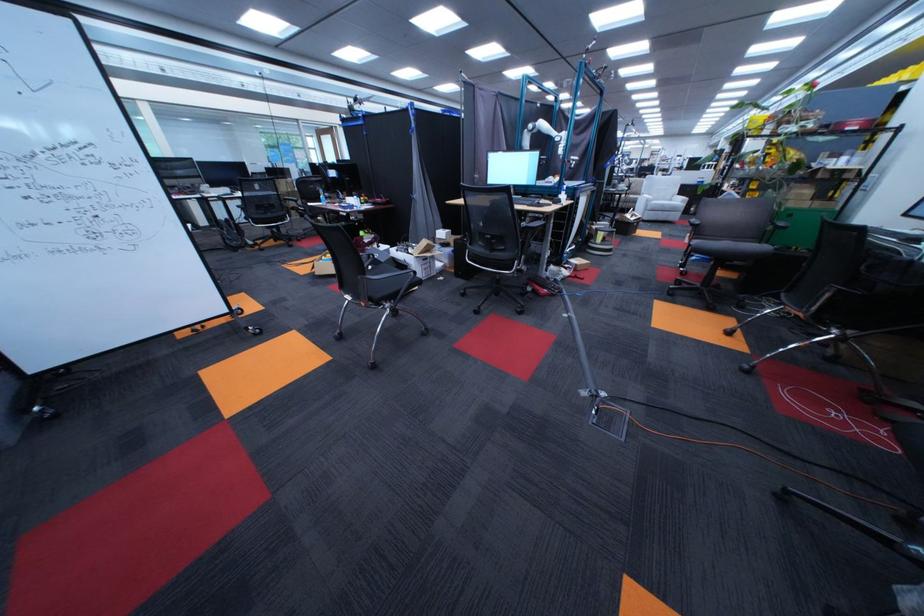
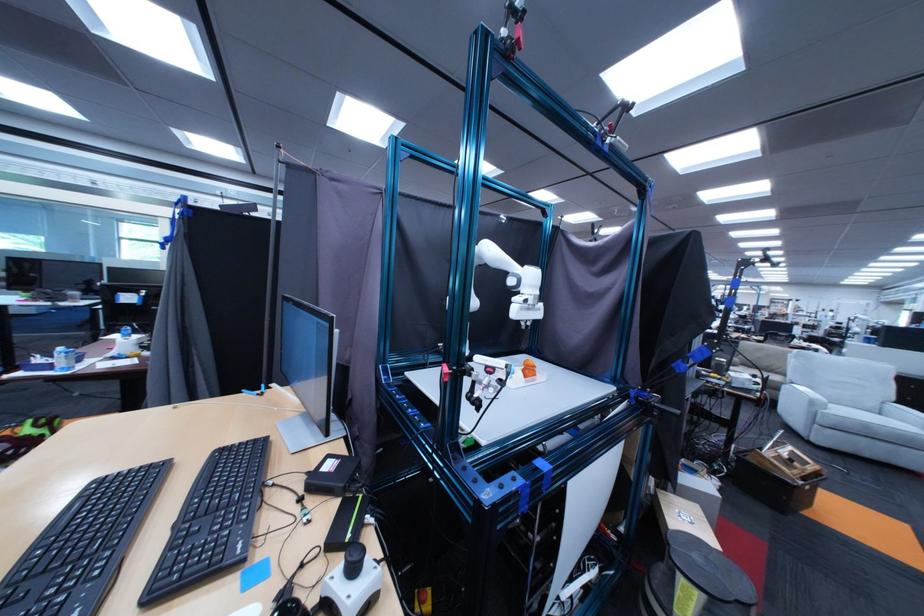
The point at (x=675, y=206) is marked in the first image. Where is the corresponding point in the second image?

(879, 426)